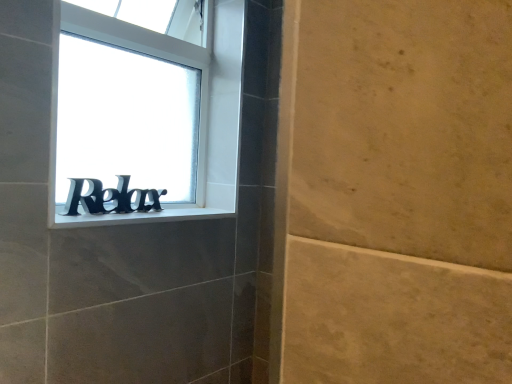
The image size is (512, 384). Describe the element at coordinates (144, 118) in the screenshot. I see `black plastic sign at lower left` at that location.

Find the location of a particular element. The width and height of the screenshot is (512, 384). black metallic letters at center is located at coordinates (110, 197).

Locate an element on the screen. The height and width of the screenshot is (384, 512). white plastic window sill at center is located at coordinates 138,217.

Is point (65, 207) positioned behind point (127, 223)?

No, it is in front of (127, 223).

Measure the distance between black metallic letters at center and white plastic window sill at center.

black metallic letters at center is 2.98 inches from white plastic window sill at center.

Based on the photo, does black metallic letters at center appear on the left side of white plastic window sill at center?

Yes.

From the image's perspective, does black metallic letters at center appear lower than white plastic window sill at center?

No, from the image's perspective, black metallic letters at center is not beneath white plastic window sill at center.

Which point is more forward, (77, 225) or (173, 181)?

The point (77, 225) is closer to the camera.

Is white plastic window sill at center bigger than black plastic sign at lower left?

No.

Between white plastic window sill at center and black plastic sign at lower left, which one has less height?

white plastic window sill at center.

Which object is thinner, white plastic window sill at center or black plastic sign at lower left?

black plastic sign at lower left is thinner.

From the image's perspective, which one is positioned higher, black plastic sign at lower left or black metallic letters at center?

From the image's view, black plastic sign at lower left is above.

Considering the sizes of black plastic sign at lower left and black metallic letters at center in the image, is black plastic sign at lower left wider or thinner than black metallic letters at center?

In the image, black plastic sign at lower left appears to be wider than black metallic letters at center.

Considering the positions of point (60, 73) and point (106, 200), is point (60, 73) closer or farther from the camera than point (106, 200)?

Point (60, 73) is closer to the camera than point (106, 200).

Is black plastic sign at lower left taller or shorter than black metallic letters at center?

Considering their sizes, black plastic sign at lower left has more height than black metallic letters at center.

Does black plastic sign at lower left turn towards white plastic window sill at center?

Yes, black plastic sign at lower left is aimed at white plastic window sill at center.

Can you confirm if black plastic sign at lower left is smaller than white plastic window sill at center?

Incorrect, black plastic sign at lower left is not smaller in size than white plastic window sill at center.

Does black plastic sign at lower left have a lesser width compared to white plastic window sill at center?

Yes.

What's the angular difference between black plastic sign at lower left and white plastic window sill at center's facing directions?

0.671 degrees.

Who is bigger, black metallic letters at center or black plastic sign at lower left?

Bigger between the two is black plastic sign at lower left.

Is black metallic letters at center beside black plastic sign at lower left?

black metallic letters at center is not next to black plastic sign at lower left, and they're not touching.

The image size is (512, 384). What are the coordinates of `window that appears on the right of black metallic letters at center` in the screenshot? It's located at (144, 118).

Is black metallic letters at center taller or shorter than black plastic sign at lower left?

black metallic letters at center is shorter than black plastic sign at lower left.

Which is farther, (55, 218) or (121, 203)?

The point (121, 203) is farther.

Is white plastic window sill at center positioned in front of black metallic letters at center?

Yes, white plastic window sill at center is closer to the camera.

I want to click on window sill that appears below the black metallic letters at center (from a real-world perspective), so click(x=138, y=217).

Find the location of a particular element. The image size is (512, 384). number that appears above the white plastic window sill at center (from a real-world perspective) is located at coordinates (110, 197).

Find the location of a particular element. The height and width of the screenshot is (384, 512). window sill below the black plastic sign at lower left (from the image's perspective) is located at coordinates (138, 217).

Looking at the image, which one is located further to black metallic letters at center, white plastic window sill at center or black plastic sign at lower left?

The object further to black metallic letters at center is black plastic sign at lower left.

Estimate the real-world distances between objects in this image. Which object is further from black plastic sign at lower left, white plastic window sill at center or black metallic letters at center?

white plastic window sill at center is positioned further to the anchor black plastic sign at lower left.

Consider the image. Based on their spatial positions, is black metallic letters at center or black plastic sign at lower left closer to white plastic window sill at center?

black metallic letters at center is closer to white plastic window sill at center.

Looking at the image, which one is located further to white plastic window sill at center, black plastic sign at lower left or black metallic letters at center?

black plastic sign at lower left is positioned further to the anchor white plastic window sill at center.

Looking at the image, which one is located closer to black metallic letters at center, black plastic sign at lower left or white plastic window sill at center?

Based on the image, white plastic window sill at center appears to be nearer to black metallic letters at center.

Which object lies nearer to the anchor point black plastic sign at lower left, black metallic letters at center or white plastic window sill at center?

black metallic letters at center is closer to black plastic sign at lower left.

This screenshot has height=384, width=512. Identify the location of number between black plastic sign at lower left and white plastic window sill at center in the vertical direction. (110, 197).